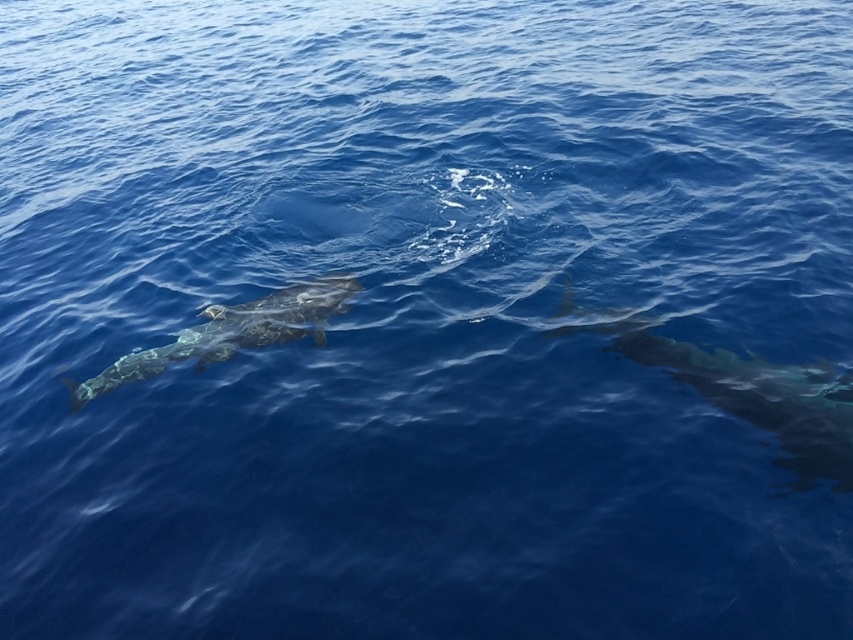
Question: Among these points, which one is nearest to the camera?

Choices:
 (A) (821, 456)
 (B) (306, 330)

Answer: (A)

Question: Which object appears farthest from the camera in this image?

Choices:
 (A) shiny dark gray whale at right
 (B) smooth gray whale at left

Answer: (B)

Question: Does shiny dark gray whale at right appear under smooth gray whale at left?

Choices:
 (A) yes
 (B) no

Answer: (A)

Question: Does shiny dark gray whale at right have a larger size compared to smooth gray whale at left?

Choices:
 (A) yes
 (B) no

Answer: (A)

Question: Can you confirm if shiny dark gray whale at right is positioned to the right of smooth gray whale at left?

Choices:
 (A) no
 (B) yes

Answer: (B)